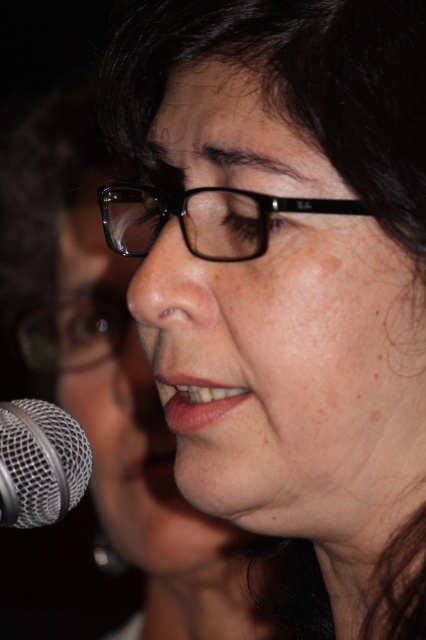
Question: Which object appears farthest from the camera in this image?

Choices:
 (A) black plastic glasses at center
 (B) black plastic glasses at upper left
 (C) silver mesh microphone at lower left

Answer: (B)

Question: Where is black plastic glasses at center located in relation to silver mesh microphone at lower left in the image?

Choices:
 (A) below
 (B) above

Answer: (B)

Question: Considering the relative positions of silver mesh microphone at lower left and black plastic glasses at upper left in the image provided, where is silver mesh microphone at lower left located with respect to black plastic glasses at upper left?

Choices:
 (A) above
 (B) below

Answer: (B)

Question: Which object is positioned farthest from the black plastic glasses at upper left?

Choices:
 (A) black plastic glasses at center
 (B) silver mesh microphone at lower left

Answer: (A)

Question: Can you confirm if black plastic glasses at center is wider than black plastic glasses at upper left?

Choices:
 (A) no
 (B) yes

Answer: (A)

Question: Estimate the real-world distances between objects in this image. Which object is closer to the silver mesh microphone at lower left?

Choices:
 (A) black plastic glasses at center
 (B) black plastic glasses at upper left

Answer: (A)